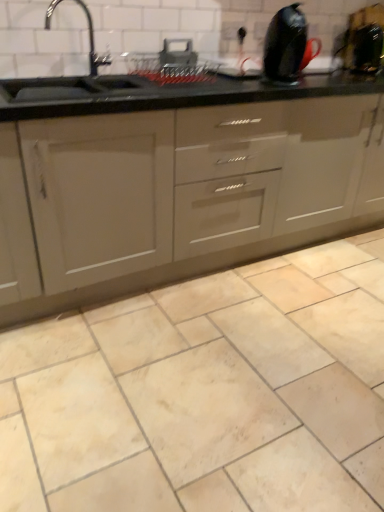
Identify the location of vacant space that is to the left of glossy black kettle at upper right, positioned as the 2th appliance in right-to-left order. The image size is (384, 512). (238, 81).